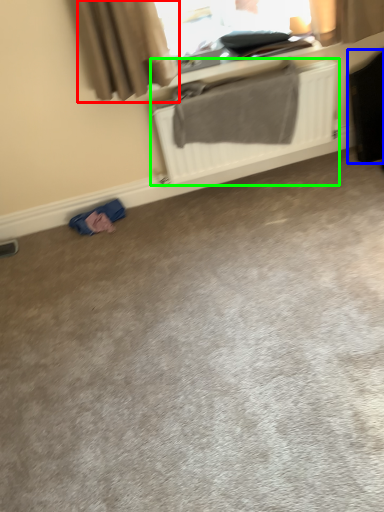
Question: Estimate the real-world distances between objects in this image. Which object is closer to curtain (highlighted by a red box), luggage (highlighted by a blue box) or radiator (highlighted by a green box)?

Choices:
 (A) luggage
 (B) radiator

Answer: (B)